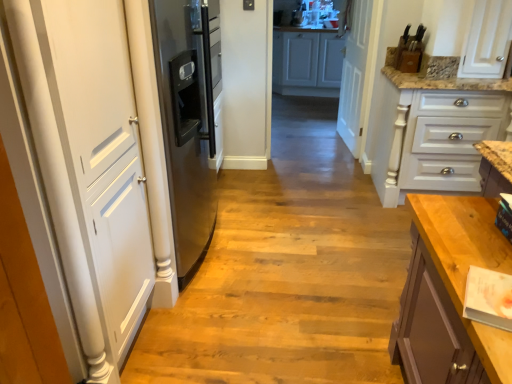
Question: From their relative heights in the image, would you say white painted wood drawers at right, placed as the 1th cabinetry when sorted from bottom to top, is taller or shorter than white wood door at center, which is the first door from right to left?

Choices:
 (A) short
 (B) tall

Answer: (A)

Question: Relative to white wood door at center, which is the first door from right to left, is white painted wood drawers at right, the 2th cabinetry viewed from the back, in front or behind?

Choices:
 (A) front
 (B) behind

Answer: (A)

Question: Which object is positioned farthest from the white wood door at center, the first door viewed from the back?

Choices:
 (A) white matte door at left, the 1th door viewed from the left
 (B) white matte cabinet at center, the second cabinetry ordered from the bottom
 (C) wooden floor at center
 (D) white painted wood drawers at right, which is the first cabinetry in front-to-back order

Answer: (A)

Question: Which of these objects is positioned farthest from the white matte door at left, the first door viewed from the front?

Choices:
 (A) white painted wood drawers at right, the 2th cabinetry viewed from the back
 (B) white matte cabinet at center, which appears as the first cabinetry when viewed from the top
 (C) white wood door at center, positioned as the 2th door in front-to-back order
 (D) wooden floor at center

Answer: (B)